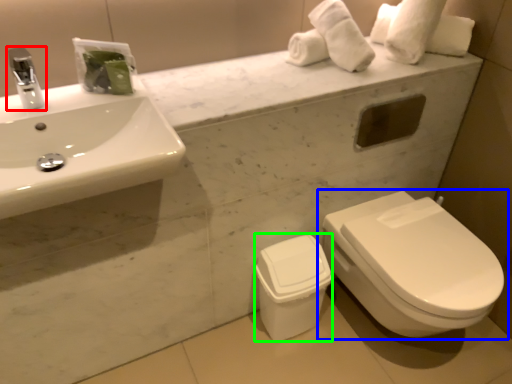
Question: Considering the real-world distances, which object is closest to tap (highlighted by a red box)? toilet (highlighted by a blue box) or porcelain (highlighted by a green box).

Choices:
 (A) toilet
 (B) porcelain

Answer: (B)